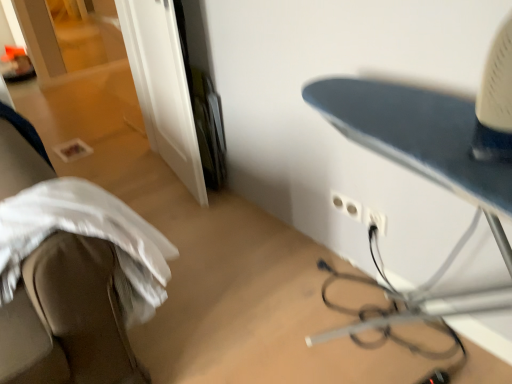
Question: Is white plastic electric outlet at center-right, which ranks as the 2th electric outlet in left-to-right order, to the left of white fabric at left from the viewer's perspective?

Choices:
 (A) yes
 (B) no

Answer: (B)

Question: Can you confirm if white plastic electric outlet at center-right, which ranks as the 2th electric outlet in left-to-right order, is thinner than white fabric at left?

Choices:
 (A) yes
 (B) no

Answer: (A)

Question: Is white plastic electric outlet at center-right, the 1th electric outlet positioned from the right, oriented towards white fabric at left?

Choices:
 (A) no
 (B) yes

Answer: (A)

Question: Is the position of white plastic electric outlet at center-right, which ranks as the 2th electric outlet in left-to-right order, more distant than that of white fabric at left?

Choices:
 (A) yes
 (B) no

Answer: (A)

Question: From a real-world perspective, is white plastic electric outlet at center-right, which ranks as the 2th electric outlet in left-to-right order, over white fabric at left?

Choices:
 (A) yes
 (B) no

Answer: (B)

Question: Is white plastic electric outlet at center-right, which ranks as the 2th electric outlet in left-to-right order, completely or partially outside of white fabric at left?

Choices:
 (A) no
 (B) yes

Answer: (B)

Question: Can we say white plastic electric outlet at lower right, the second electric outlet viewed from the right, lies outside white fabric at left?

Choices:
 (A) yes
 (B) no

Answer: (A)

Question: Is white plastic electric outlet at lower right, the 1th electric outlet viewed from the left, next to white fabric at left?

Choices:
 (A) no
 (B) yes

Answer: (A)

Question: Considering the relative sizes of white plastic electric outlet at lower right, the second electric outlet viewed from the right, and white fabric at left in the image provided, is white plastic electric outlet at lower right, the second electric outlet viewed from the right, taller than white fabric at left?

Choices:
 (A) no
 (B) yes

Answer: (A)

Question: From the image's perspective, is white plastic electric outlet at lower right, the second electric outlet viewed from the right, on top of white fabric at left?

Choices:
 (A) yes
 (B) no

Answer: (A)

Question: Could you tell me if white plastic electric outlet at lower right, the 1th electric outlet viewed from the left, is turned towards white fabric at left?

Choices:
 (A) yes
 (B) no

Answer: (A)

Question: Can you confirm if white plastic electric outlet at lower right, the 1th electric outlet viewed from the left, is smaller than white fabric at left?

Choices:
 (A) yes
 (B) no

Answer: (A)

Question: Is white plastic electric outlet at center-right, which ranks as the 2th electric outlet in left-to-right order, shorter than white plastic electric outlet at lower right, the 1th electric outlet viewed from the left?

Choices:
 (A) no
 (B) yes

Answer: (A)